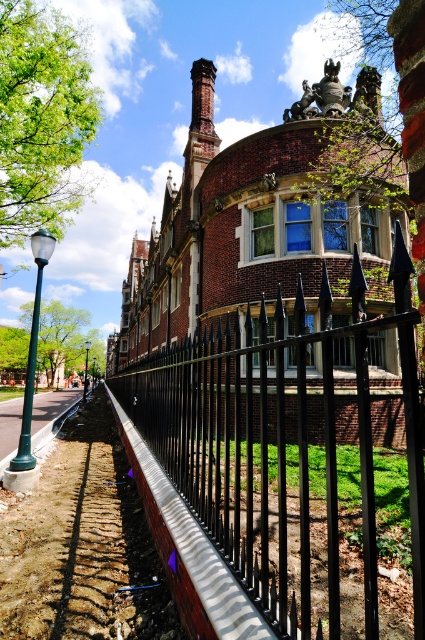
Who is more forward, (362,28) or (44,436)?

Positioned in front is point (44,436).

The image size is (425, 640). In order to click on green leafy tree at upper center in this screenshot , I will do `click(365, 44)`.

Who is more forward, (354, 22) or (70, 401)?

Point (70, 401) is more forward.

Locate an element on the screen. The image size is (425, 640). green leafy tree at upper center is located at coordinates (365, 44).

Can you confirm if black wrought iron fence at center is positioned to the right of green leafy tree at upper center?

No, black wrought iron fence at center is not to the right of green leafy tree at upper center.

Measure the distance between point (201, 452) and camera.

Point (201, 452) and camera are 3.56 meters apart from each other.

What do you see at coordinates (277, 448) in the screenshot?
I see `black wrought iron fence at center` at bounding box center [277, 448].

Find the location of a particular element. The height and width of the screenshot is (640, 425). black wrought iron fence at center is located at coordinates (277, 448).

Which is behind, point (39, 147) or point (385, 93)?

Positioned behind is point (385, 93).

What do you see at coordinates (42, 120) in the screenshot?
I see `green leafy tree at upper left` at bounding box center [42, 120].

Between point (68, 116) and point (339, 0), which one is positioned in front?

Point (68, 116) is in front.

At what (x,y) coordinates should I click in order to perform the action: click on green leafy tree at upper left. Please return your answer as a coordinate pair (x, y). Looking at the image, I should click on (42, 120).